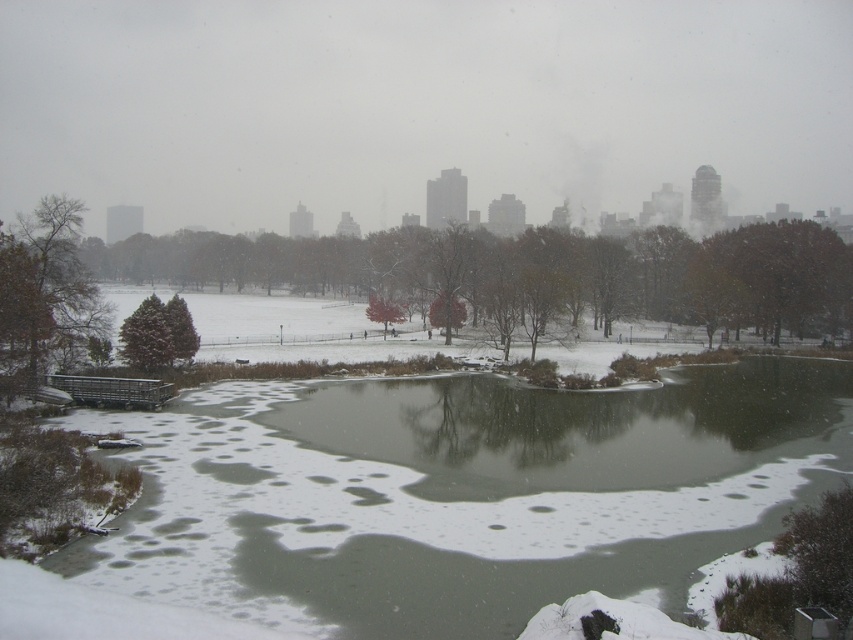
Question: Considering the relative positions of bare branches at left and snow-covered evergreen at center-left in the image provided, where is bare branches at left located with respect to snow-covered evergreen at center-left?

Choices:
 (A) below
 (B) above

Answer: (B)

Question: Which point is closer to the camera?

Choices:
 (A) (830, 276)
 (B) (512, 240)
 (C) (177, 356)

Answer: (C)

Question: Which point appears closest to the camera in this image?

Choices:
 (A) (785, 289)
 (B) (82, 320)
 (C) (183, 234)

Answer: (B)

Question: Which point is closer to the camera?

Choices:
 (A) (347, 253)
 (B) (30, 266)
 (C) (695, 298)

Answer: (B)

Question: Can you confirm if green leafy tree at center is positioned to the left of snow-covered evergreen at center-left?

Choices:
 (A) yes
 (B) no

Answer: (B)

Question: Does green leafy tree at center have a lesser width compared to snow-covered evergreen at center-left?

Choices:
 (A) yes
 (B) no

Answer: (B)